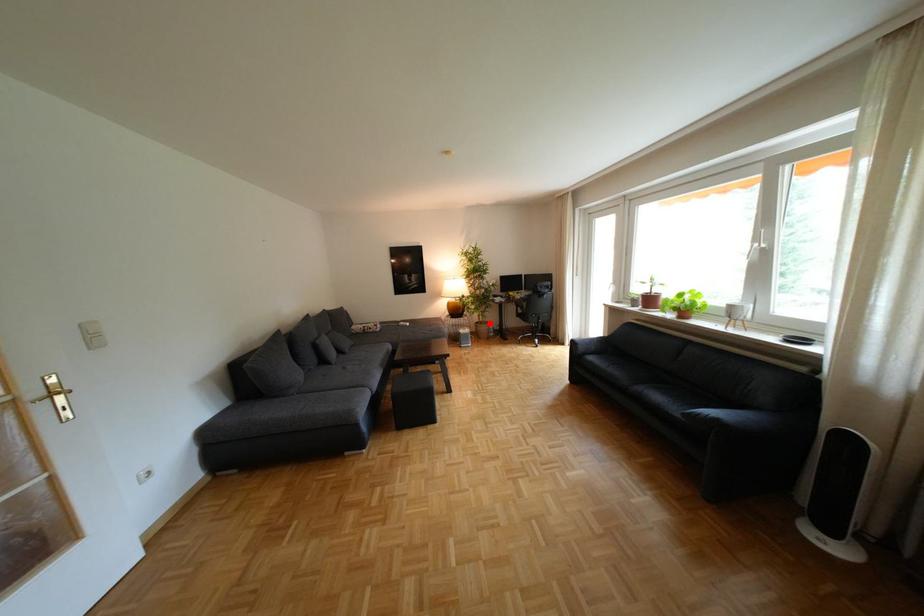
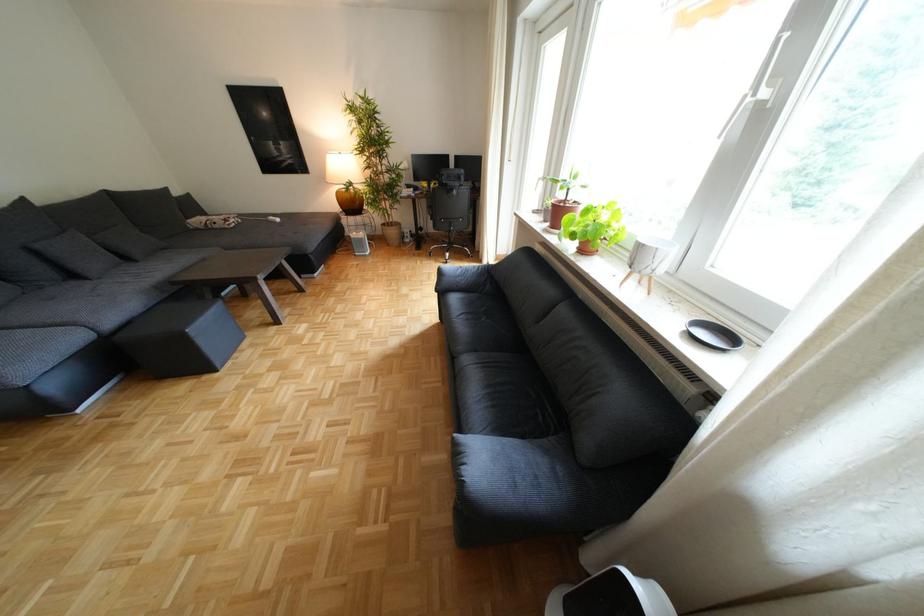
Question: A red point is marked in image1. In image2, is the corresponding 3D point closer to the camera or farther? Reply with the corresponding letter.

Choices:
 (A) The corresponding 3D point is closer.
 (B) The corresponding 3D point is farther.

Answer: (A)